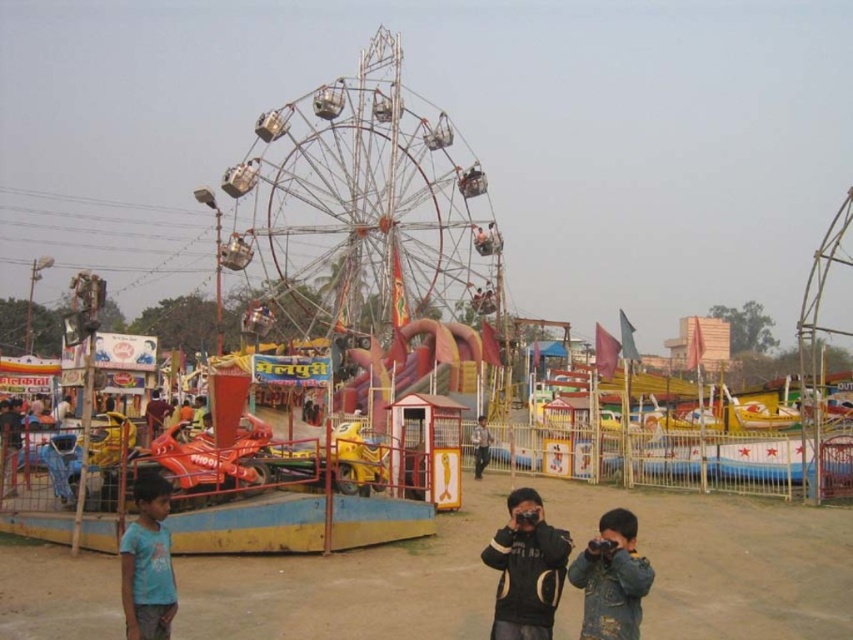
This screenshot has height=640, width=853. I want to click on denim jacket at lower right, so click(x=611, y=579).

Can you confirm if denim jacket at lower right is bigger than blue cotton shirt at lower left?

Actually, denim jacket at lower right might be smaller than blue cotton shirt at lower left.

Describe the element at coordinates (611, 579) in the screenshot. I see `denim jacket at lower right` at that location.

The height and width of the screenshot is (640, 853). I want to click on denim jacket at lower right, so click(x=611, y=579).

Does metallic ferris wheel at center have a larger size compared to light brown wooden pole at center?

Yes, metallic ferris wheel at center is bigger than light brown wooden pole at center.

Can you confirm if metallic ferris wheel at center is shorter than light brown wooden pole at center?

No.

The height and width of the screenshot is (640, 853). Find the location of `metallic ferris wheel at center`. metallic ferris wheel at center is located at coordinates (363, 211).

Can you confirm if metallic ferris wheel at center is smaller than black matte jacket at center?

Actually, metallic ferris wheel at center might be larger than black matte jacket at center.

Measure the distance from metallic ferris wheel at center to black matte jacket at center.

metallic ferris wheel at center and black matte jacket at center are 106.20 meters apart from each other.

Locate an element on the screen. metallic ferris wheel at center is located at coordinates (363, 211).